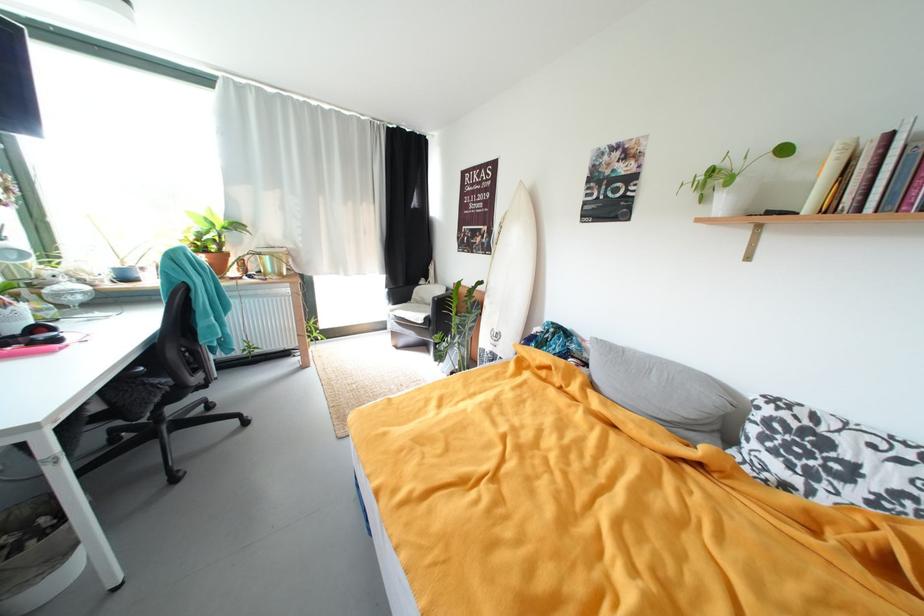
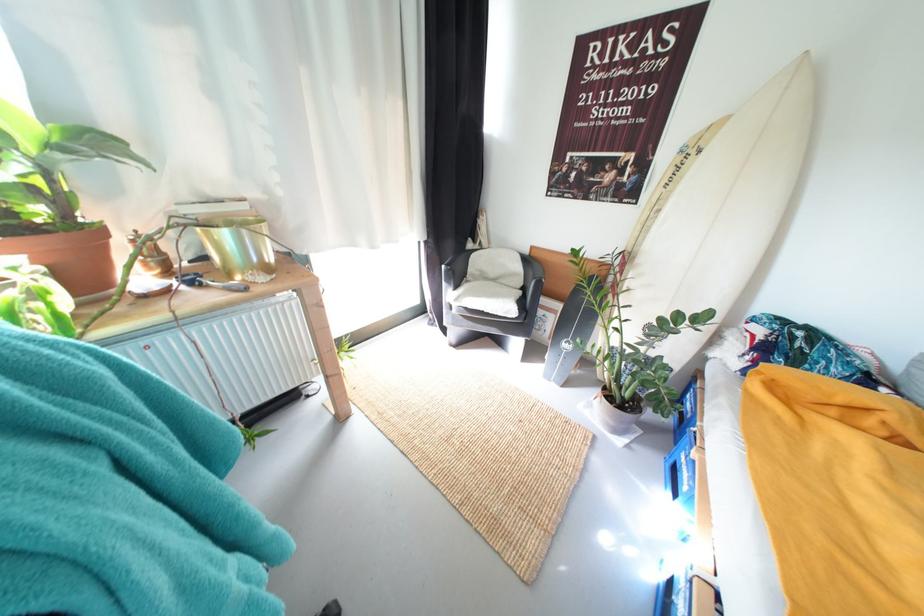
Which direction would the cameraman need to move to produce the second image?

The cameraman walked toward left, forward.